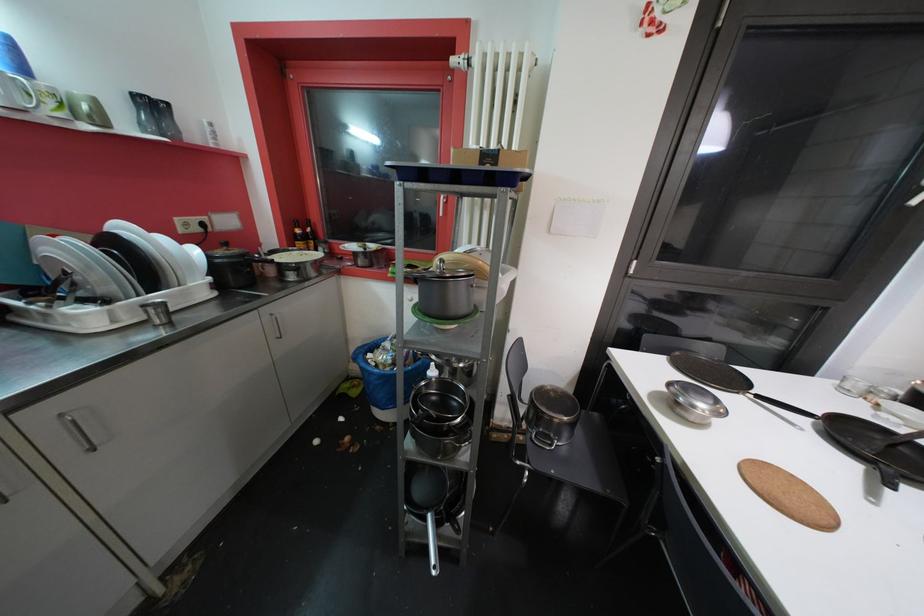
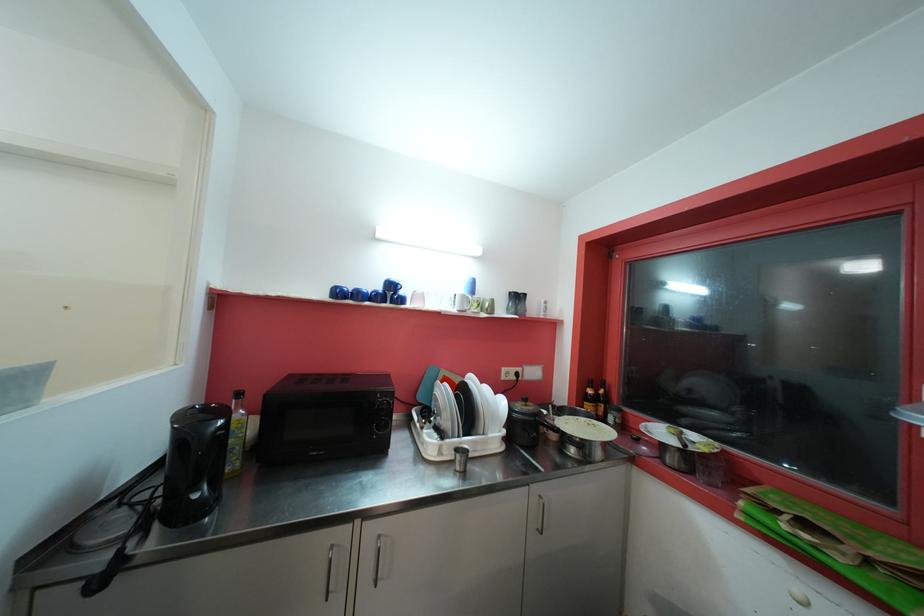
Where in the second image is the point corresponding to point (231, 246) from the first image?

(530, 403)